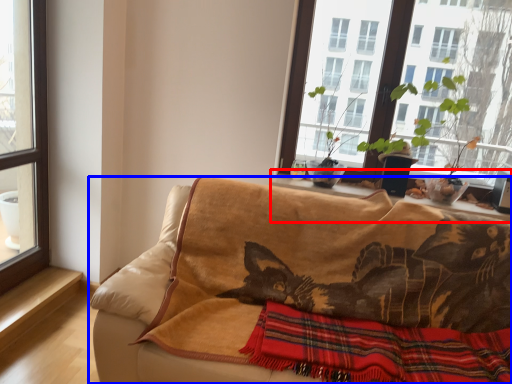
Question: Which object appears farthest to the camera in this image, window sill (highlighted by a red box) or studio couch (highlighted by a blue box)?

Choices:
 (A) window sill
 (B) studio couch

Answer: (A)